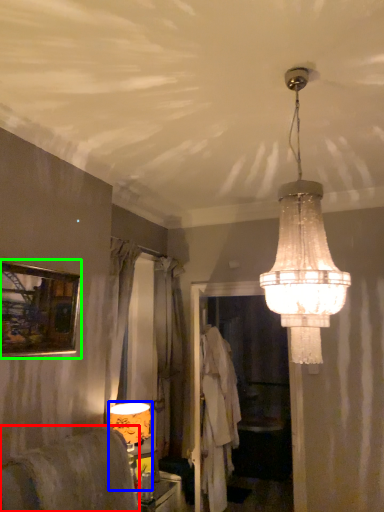
Question: Considering the real-world distances, which object is closest to furniture (highlighted by a red box)? lamp (highlighted by a blue box) or picture frame (highlighted by a green box).

Choices:
 (A) lamp
 (B) picture frame

Answer: (A)